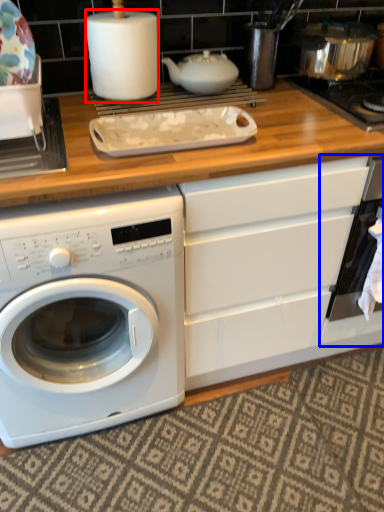
Question: Among these objects, which one is nearest to the camera, paper towel (highlighted by a red box) or oven (highlighted by a blue box)?

Choices:
 (A) paper towel
 (B) oven

Answer: (A)